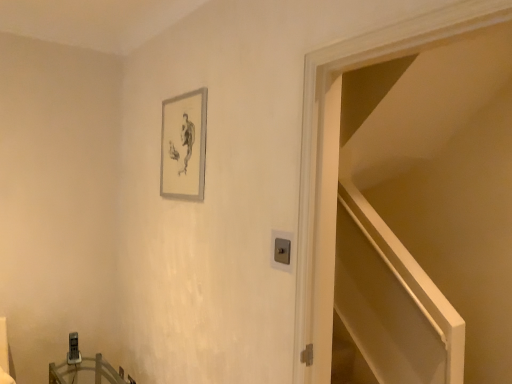
Question: Is silver metallic picture frame at upper center positioned behind wooden table at lower left?

Choices:
 (A) no
 (B) yes

Answer: (A)

Question: From a real-world perspective, is silver metallic picture frame at upper center located higher than wooden table at lower left?

Choices:
 (A) yes
 (B) no

Answer: (A)

Question: From the image's perspective, is silver metallic picture frame at upper center over wooden table at lower left?

Choices:
 (A) no
 (B) yes

Answer: (B)

Question: Is silver metallic picture frame at upper center aimed at wooden table at lower left?

Choices:
 (A) no
 (B) yes

Answer: (A)

Question: Is silver metallic picture frame at upper center to the left of wooden table at lower left from the viewer's perspective?

Choices:
 (A) yes
 (B) no

Answer: (B)

Question: From the image's perspective, is white glossy door at upper right above or below wooden table at lower left?

Choices:
 (A) above
 (B) below

Answer: (A)

Question: Is point (303, 306) positioned closer to the camera than point (130, 382)?

Choices:
 (A) farther
 (B) closer

Answer: (B)

Question: Is white glossy door at upper right wider or thinner than wooden table at lower left?

Choices:
 (A) wide
 (B) thin

Answer: (B)

Question: In terms of height, does white glossy door at upper right look taller or shorter compared to wooden table at lower left?

Choices:
 (A) tall
 (B) short

Answer: (A)

Question: Considering the positions of wooden table at lower left and silver metallic picture frame at upper center in the image, is wooden table at lower left bigger or smaller than silver metallic picture frame at upper center?

Choices:
 (A) small
 (B) big

Answer: (B)

Question: From a real-world perspective, relative to silver metallic picture frame at upper center, is wooden table at lower left vertically above or below?

Choices:
 (A) below
 (B) above

Answer: (A)

Question: Based on their positions, is wooden table at lower left located to the left or right of silver metallic picture frame at upper center?

Choices:
 (A) left
 (B) right

Answer: (A)

Question: Is wooden table at lower left wider or thinner than silver metallic picture frame at upper center?

Choices:
 (A) thin
 (B) wide

Answer: (B)

Question: From a real-world perspective, is silver metallic picture frame at upper center above or below wooden table at lower left?

Choices:
 (A) above
 (B) below

Answer: (A)

Question: Is silver metallic picture frame at upper center wider or thinner than wooden table at lower left?

Choices:
 (A) wide
 (B) thin

Answer: (B)